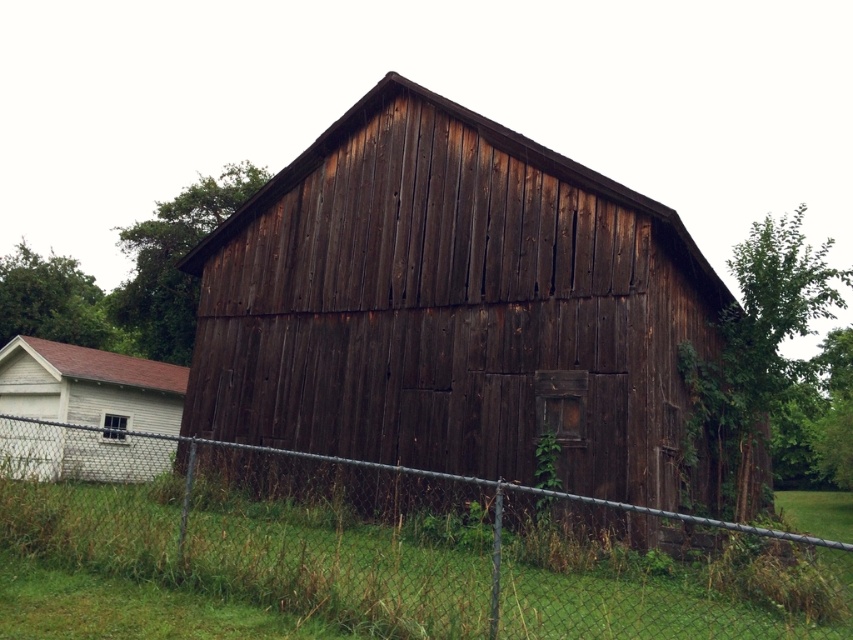
You are a farmer standing at the edge of your property and notice the dark wood barn at center and the green grass at lower center. Which object takes up more visual space in the image?

The green grass at lower center takes up more visual space than the dark wood barn at center because the description states that the dark wood barn at center is smaller than green grass at lower center.

You are standing in a field and see the dark wood barn at center and the green grass at lower center. Which object is closer to you?

The dark wood barn at center is closer to you than the green grass at lower center because it is further to the viewer.